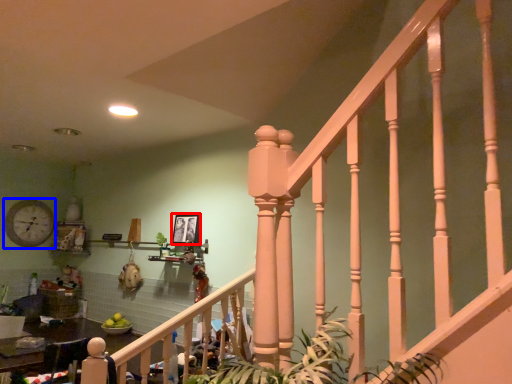
Question: Which object is closer to the camera taking this photo, picture frame (highlighted by a red box) or clock (highlighted by a blue box)?

Choices:
 (A) picture frame
 (B) clock

Answer: (A)